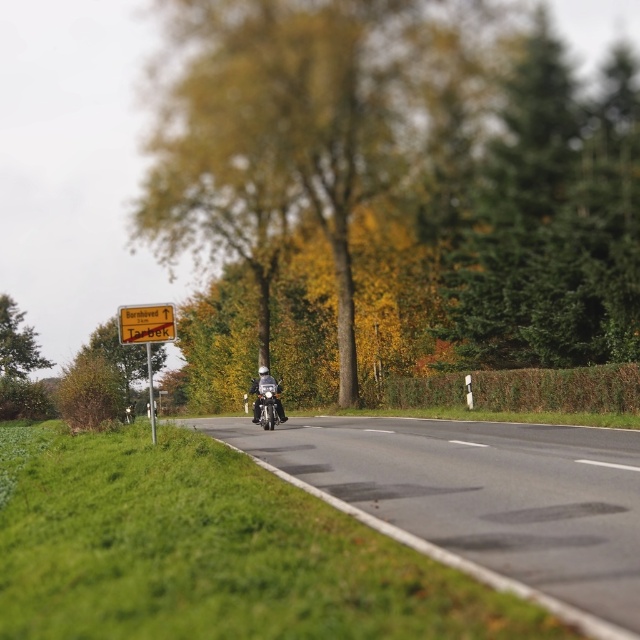
You are a pedestrian standing on the grassy verge to the left of the road. You see the green leafy tree at center and the shiny black motorcycle at center. Which object is closer to your current position?

The green leafy tree at center is closer to your current position on the grassy verge to the left of the road because it is positioned on the left side of the shiny black motorcycle at center, which is in the center of the road.

You are a pedestrian standing at the side of the road and want to cross to the other side. The green leafy tree at center and the shiny black motorcycle at center are in your path. Which object is taller, and does this affect your ability to see over it while crossing?

The green leafy tree at center is taller than the shiny black motorcycle at center. Since the tree is taller, it might block your view while crossing, but the motorcycle is shorter, so it would not obstruct your line of sight as much.